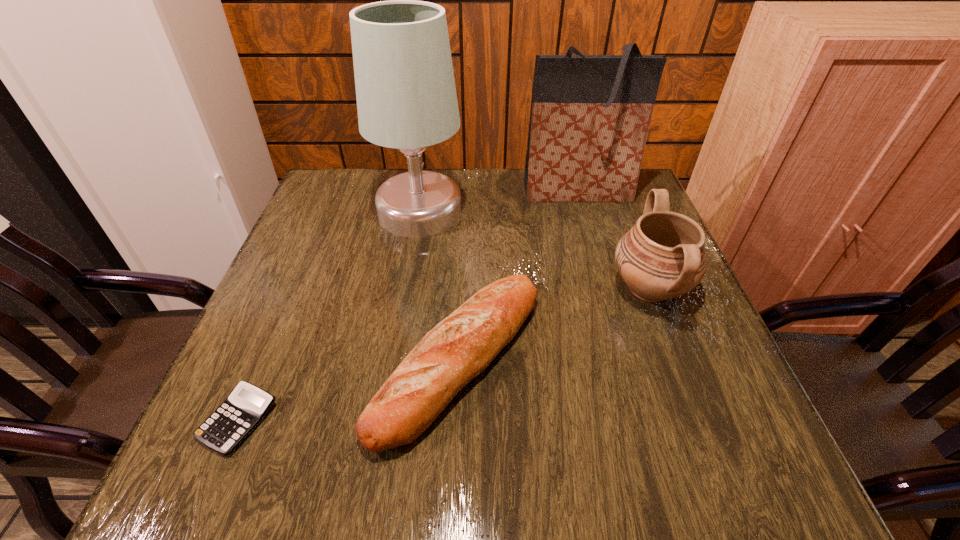
I want to click on free spot located 0.390m on the front-facing side of the third shortest object, so click(x=429, y=288).

You are a GUI agent. You are given a task and a screenshot of the screen. Output one action in this format:
    pyautogui.click(x=<x>, y=<y>)
    Task: Click on the vacant point located on the back of the second shortest object
    This screenshot has width=960, height=540.
    Given the screenshot: What is the action you would take?
    (465, 232)

I want to click on vacant space situated on the back of the calculator, so click(x=305, y=262).

At what (x,y) coordinates should I click in order to perform the action: click on lampshade located in the far edge section of the desktop. Please return your answer as a coordinate pair (x, y). Image resolution: width=960 pixels, height=540 pixels. Looking at the image, I should click on (406, 97).

The height and width of the screenshot is (540, 960). In order to click on shopping bag present at the far edge in this screenshot , I will do `click(590, 115)`.

Find the location of a particular element. This screenshot has height=540, width=960. baguet that is at the near edge is located at coordinates (460, 347).

This screenshot has height=540, width=960. I want to click on calculator situated at the near edge, so click(245, 407).

The image size is (960, 540). What are the coordinates of `object positioned at the left edge` in the screenshot? It's located at (245, 407).

What are the coordinates of `shopping bag present at the right edge` in the screenshot? It's located at (590, 115).

In order to click on urn present at the right edge in this screenshot , I will do `click(662, 256)`.